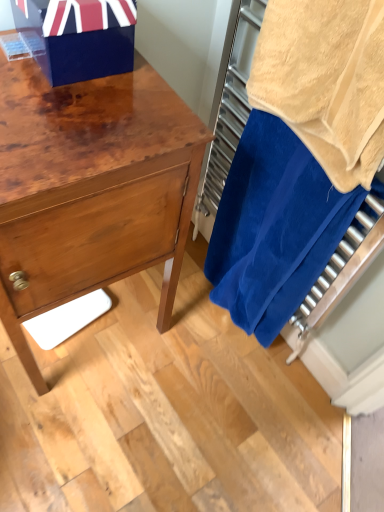
Image resolution: width=384 pixels, height=512 pixels. Find the location of `vacant area in front of shiny blue gift box at upper left`. vacant area in front of shiny blue gift box at upper left is located at coordinates (61, 101).